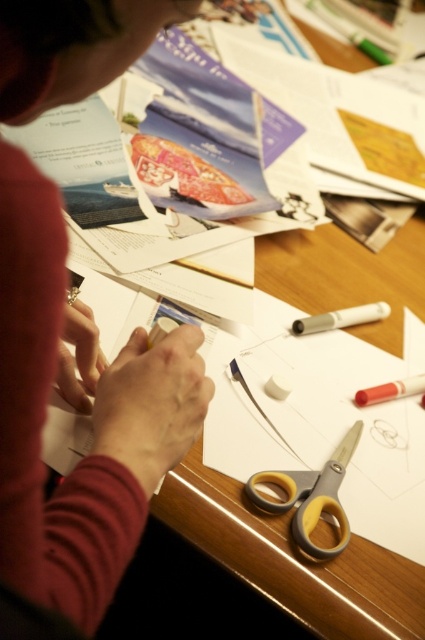
Question: Based on their relative distances, which object is farther from the yellow rubberized scissors at center?

Choices:
 (A) matte white pencil at center-right
 (B) matte red sweater at upper left
 (C) white matte marker at center

Answer: (B)

Question: Is matte red sweater at upper left bigger than yellow rubberized scissors at center?

Choices:
 (A) yes
 (B) no

Answer: (A)

Question: Does yellow rubberized scissors at center have a larger size compared to matte white pencil at center-right?

Choices:
 (A) no
 (B) yes

Answer: (B)

Question: Which object is the farthest from the matte white pencil at center-right?

Choices:
 (A) matte red sweater at upper left
 (B) yellow rubberized scissors at center
 (C) white matte marker at center

Answer: (A)

Question: Can you confirm if matte red sweater at upper left is wider than white matte marker at center?

Choices:
 (A) yes
 (B) no

Answer: (B)

Question: Which object appears closest to the camera in this image?

Choices:
 (A) yellow rubberized scissors at center
 (B) matte white pencil at center-right
 (C) white matte marker at center

Answer: (A)